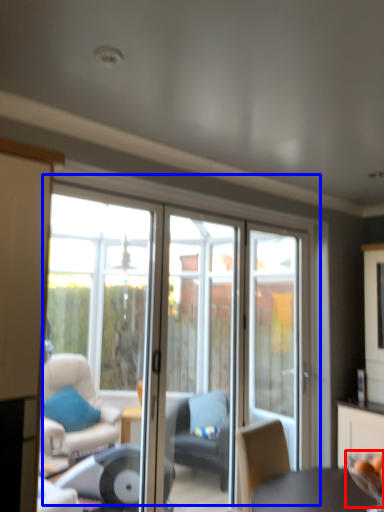
Question: Which point is further to the camera, glass bowl (highlighted by a red box) or door (highlighted by a blue box)?

Choices:
 (A) glass bowl
 (B) door

Answer: (B)